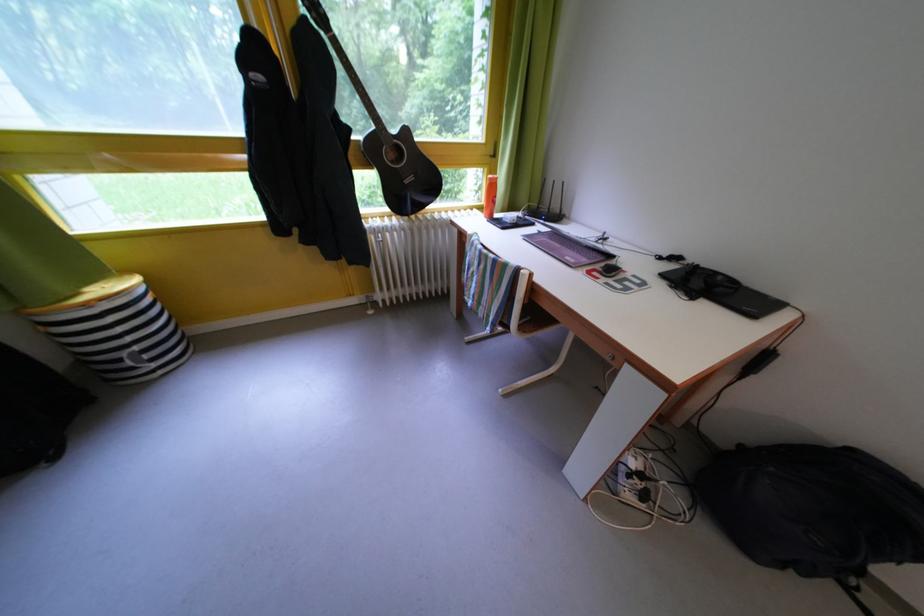
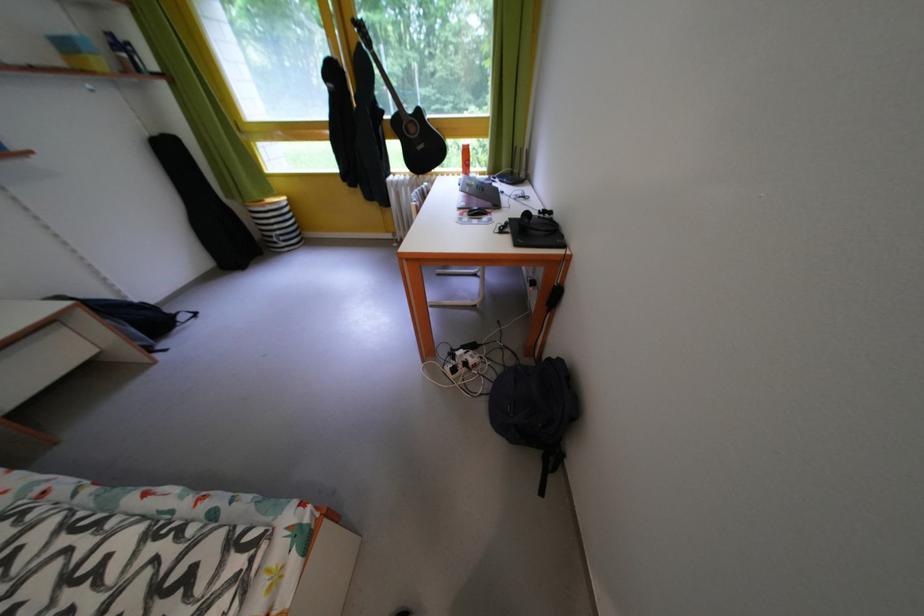
Where in the second image is the point corresponding to (x=359, y=135) from the first image?

(393, 118)